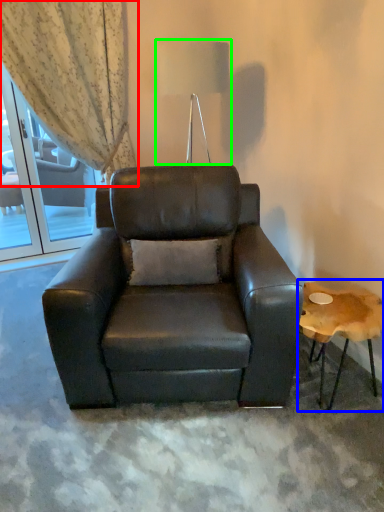
Question: Which object is positioned farthest from curtain (highlighted by a red box)? Select from table (highlighted by a blue box) and table lamp (highlighted by a green box).

Choices:
 (A) table
 (B) table lamp

Answer: (A)